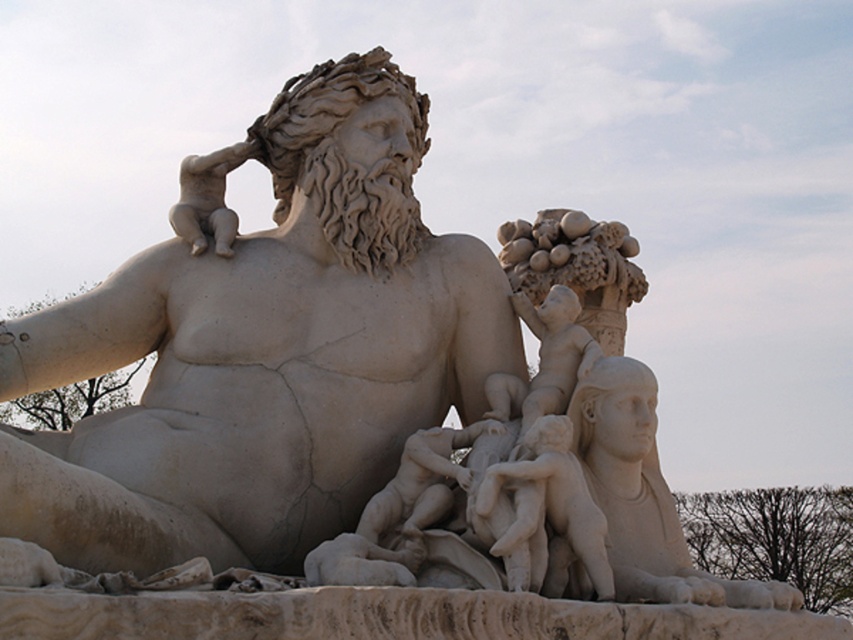
Is white marble statue at center to the left of smooth white cherub at center from the viewer's perspective?

Yes, white marble statue at center is to the left of smooth white cherub at center.

Can you confirm if white marble statue at center is wider than smooth white cherub at center?

Indeed, white marble statue at center has a greater width compared to smooth white cherub at center.

Describe the element at coordinates (263, 353) in the screenshot. I see `white marble statue at center` at that location.

Find the location of a particular element. Image resolution: width=853 pixels, height=640 pixels. white marble statue at center is located at coordinates (263, 353).